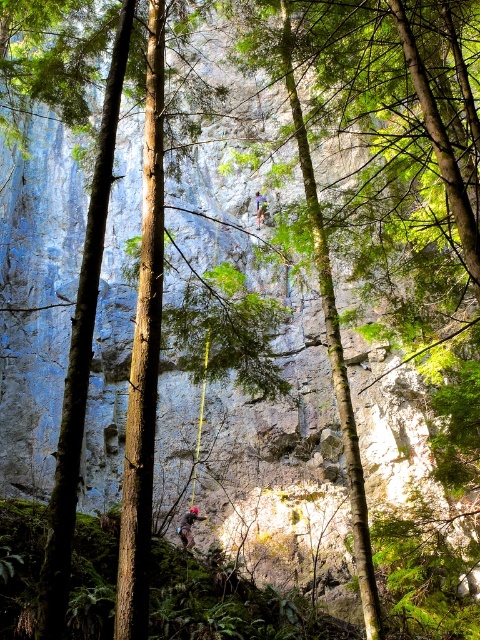
Question: Can you confirm if red climbing harness at center is wider than blue fabric climbing harness at center?

Choices:
 (A) yes
 (B) no

Answer: (A)

Question: Which of the following is the farthest from the observer?

Choices:
 (A) (256, 220)
 (B) (196, 509)

Answer: (A)

Question: Is red climbing harness at center bigger than blue fabric climbing harness at center?

Choices:
 (A) yes
 (B) no

Answer: (A)

Question: Among these objects, which one is farthest from the camera?

Choices:
 (A) blue fabric climbing harness at center
 (B) red climbing harness at center

Answer: (A)

Question: Can you confirm if red climbing harness at center is smaller than blue fabric climbing harness at center?

Choices:
 (A) yes
 (B) no

Answer: (B)